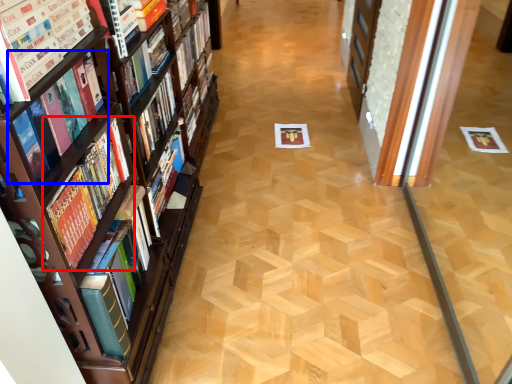
Question: Which of the following is the closest to the observer, book (highlighted by a red box) or book (highlighted by a blue box)?

Choices:
 (A) book
 (B) book

Answer: (B)